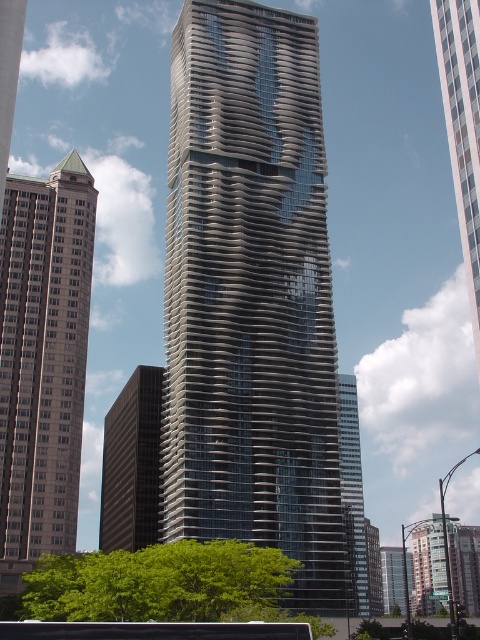
You are an architect analyzing the skyline of this city. You notice the gray concrete skyscraper at center and the glassy reflective skyscraper at right. Which one has a greater height?

The gray concrete skyscraper at center is taller than the glassy reflective skyscraper at right.

You are standing in the city and see the gray concrete skyscraper at center and the black rubber tour bus at lower center. Which object is closer to you?

The black rubber tour bus at lower center is closer to you because it is positioned in front of the gray concrete skyscraper at center, which is further away.

You are a city planner analyzing the image. You need to determine if the glassy reflective skyscraper at right can be seen in the side mirrors of the black rubber tour bus at lower center. Based on their relative sizes, what is your conclusion?

The glassy reflective skyscraper at right is wider than the black rubber tour bus at lower center. Since the skyscraper is significantly larger in width, it is likely that parts of it would be visible in the side mirrors of the black rubber tour bus at lower center, provided they are positioned within the mirrors field of view.